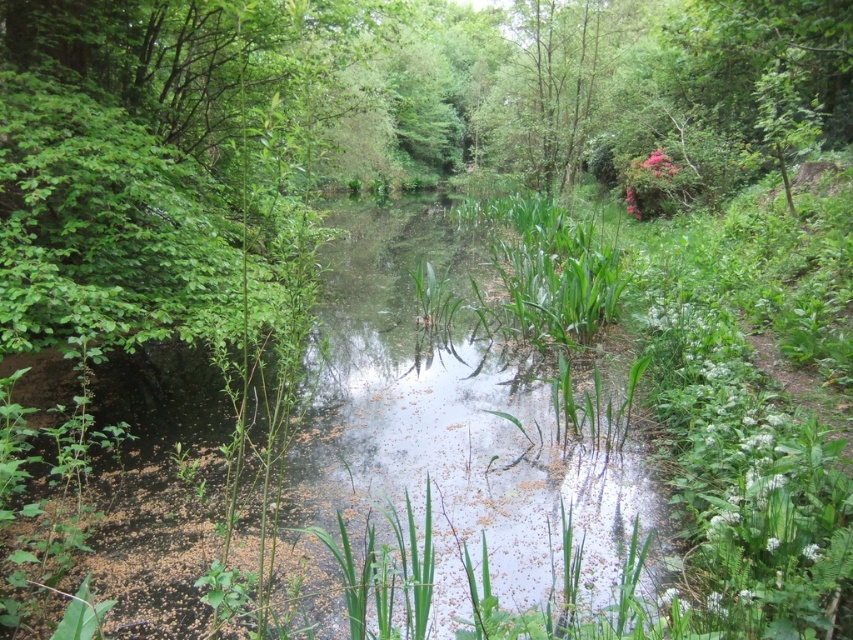
Which is below, green leafy water at center or green leafy tree at upper center?

green leafy water at center is below.

Is green leafy water at center shorter than green leafy tree at upper center?

Yes.

This screenshot has height=640, width=853. Describe the element at coordinates (451, 428) in the screenshot. I see `green leafy water at center` at that location.

You are a GUI agent. You are given a task and a screenshot of the screen. Output one action in this format:
    pyautogui.click(x=<x>, y=<y>)
    Task: Click on the green leafy water at center
    The height and width of the screenshot is (640, 853).
    Given the screenshot: What is the action you would take?
    pyautogui.click(x=451, y=428)